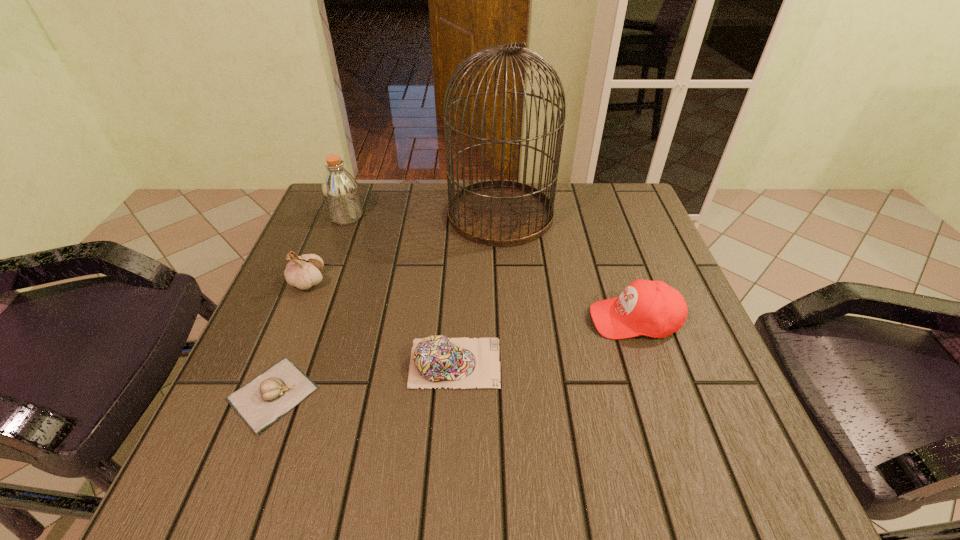
Identify which object is the nearest to the birdcage. Please provide its 2D coordinates. Your answer should be formatted as a tuple, i.e. [(x, y)], where the tuple contains the x and y coordinates of a point satisfying the conditions above.

[(652, 308)]

At what (x,y) coordinates should I click in order to perform the action: click on vacant space that satisfies the following two spatial constraints: 1. on the back side of the birdcage; 2. on the right side of the fourth nearest object. Please return your answer as a coordinate pair (x, y). Looking at the image, I should click on (336, 214).

Identify the location of vacant region that satisfies the following two spatial constraints: 1. on the back side of the tallest object; 2. on the left side of the bottle. (348, 214).

Locate an element on the screen. The image size is (960, 540). free spot that satisfies the following two spatial constraints: 1. on the front panel of the rightmost object; 2. on the front side of the nearer garlic is located at coordinates (660, 394).